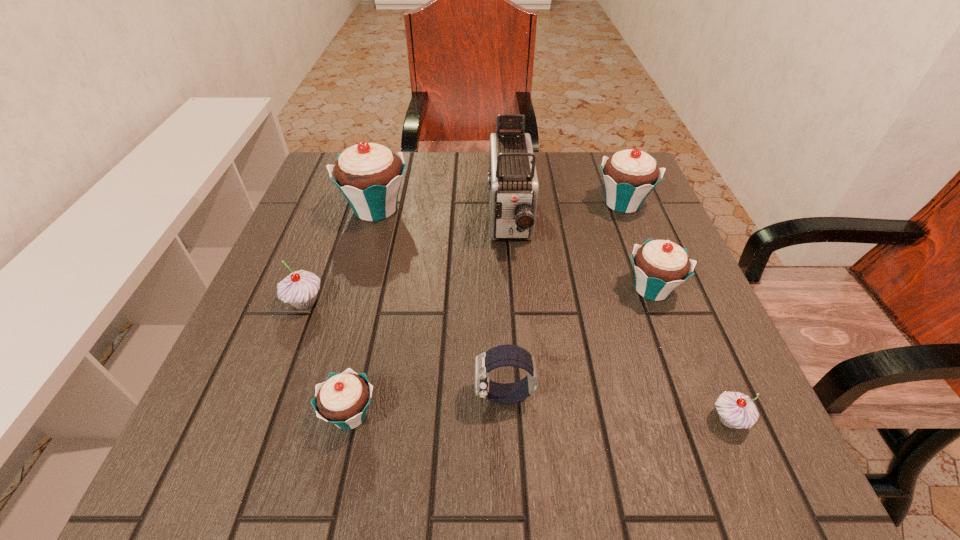
The height and width of the screenshot is (540, 960). I want to click on vacant space at the near left corner of the desktop, so click(244, 463).

The height and width of the screenshot is (540, 960). What are the coordinates of `vacant space at the far right corner of the desktop` in the screenshot? It's located at (596, 173).

Locate an element on the screen. free area in between the third biggest teal cupcake and the tallest cupcake is located at coordinates (514, 249).

The image size is (960, 540). Find the location of `vacant point located between the seventh shortest object and the second nearest teal cupcake`. vacant point located between the seventh shortest object and the second nearest teal cupcake is located at coordinates (514, 249).

Find the location of a particular element. The width and height of the screenshot is (960, 540). free space between the smallest teal cupcake and the camcorder is located at coordinates (430, 316).

Find the location of a particular element. The height and width of the screenshot is (540, 960). free space between the dark watch and the nearest teal cupcake is located at coordinates (427, 405).

Find the location of `vacant space that is in between the watch and the camcorder`. vacant space that is in between the watch and the camcorder is located at coordinates [x=507, y=307].

Where is `free space between the nearest teal cupcake and the camcorder`? This screenshot has width=960, height=540. free space between the nearest teal cupcake and the camcorder is located at coordinates (430, 316).

Image resolution: width=960 pixels, height=540 pixels. I want to click on unoccupied area between the smallest teal cupcake and the camcorder, so click(430, 316).

Where is `object that stands as the seventh closest to the camcorder`? The height and width of the screenshot is (540, 960). object that stands as the seventh closest to the camcorder is located at coordinates (736, 410).